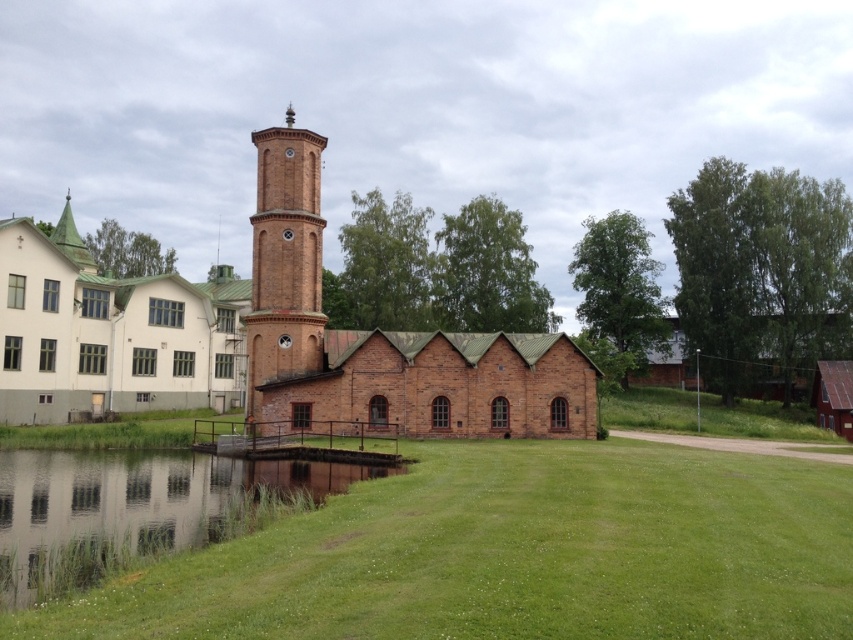
Question: Which of the following is the closest to the observer?

Choices:
 (A) (251, 134)
 (B) (160, 308)
 (C) (30, 506)
 (D) (271, 154)

Answer: (C)

Question: Is green grass at lower left smaller than red brick bell tower at center?

Choices:
 (A) yes
 (B) no

Answer: (A)

Question: Among these points, which one is farthest from the camera?

Choices:
 (A) (254, 364)
 (B) (3, 598)
 (C) (286, 164)

Answer: (C)

Question: Among these points, which one is farthest from the camera?

Choices:
 (A) (259, 246)
 (B) (241, 404)

Answer: (B)

Question: Is brick building at center closer to camera compared to white painted wood church at left?

Choices:
 (A) yes
 (B) no

Answer: (A)

Question: From the image, what is the correct spatial relationship of white painted wood church at left in relation to red brick bell tower at center?

Choices:
 (A) below
 (B) above

Answer: (B)